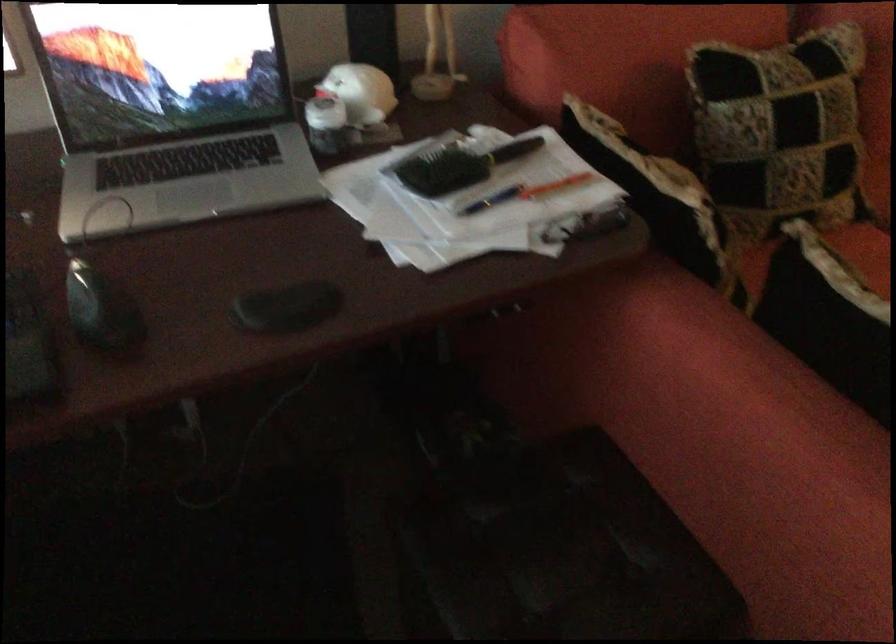
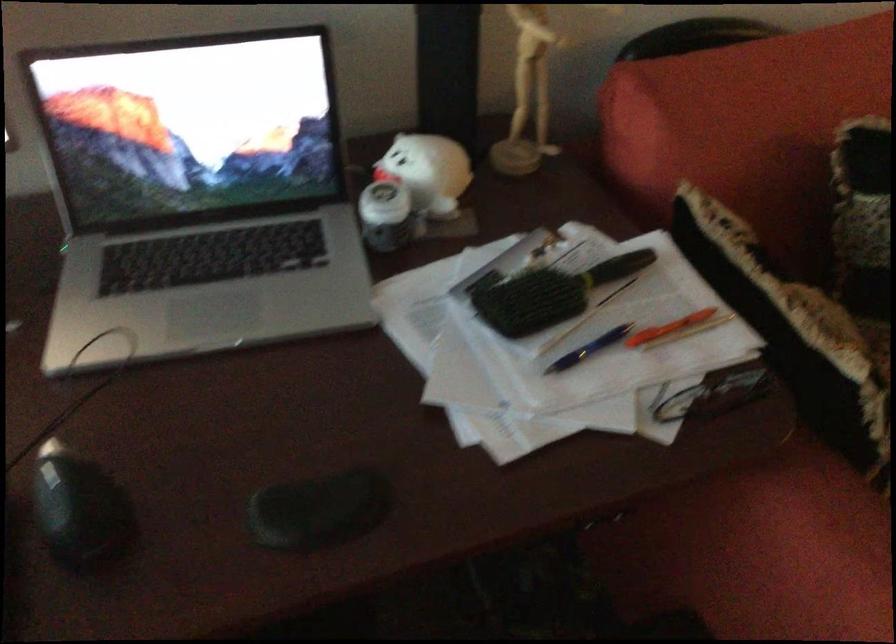
Where in the second image is the point corresponding to [359,88] from the first image?

(428, 172)